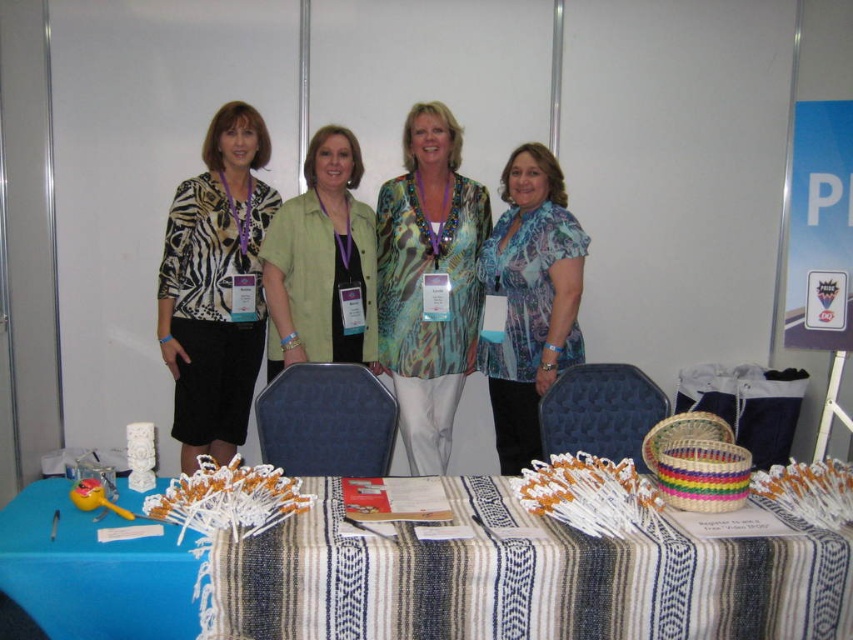
You are a photographer at the convention. You need to decide which of the two center items, the printed silk blouse at center or the green matte shirt at center, will require more space on the camera frame to capture fully. Which one do you choose?

The printed silk blouse at center is bigger than the green matte shirt at center, so the printed silk blouse at center will require more space on the camera frame to capture fully.

You are a photographer at the convention and need to capture a clear shot of both the blue striped tablecloth at center and the blue sheer blouse at center. Since you can only focus on one object at a time, which one should you focus on first to ensure it appears sharp in the photo?

You should focus on the blue striped tablecloth at center first because it is closer to the viewer than the blue sheer blouse at center. By focusing on the closer object, you can ensure it remains sharp while the background object may naturally blur, but if you focus on the farther one, both might not be in focus simultaneously.